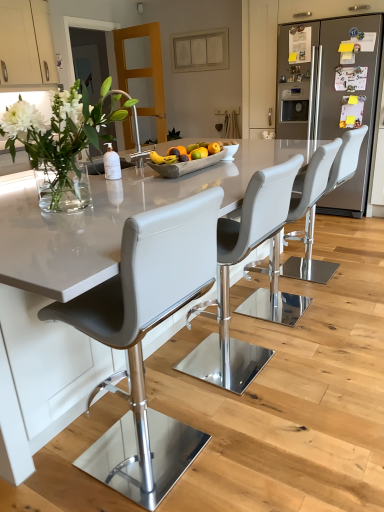
Question: From the image's perspective, is white glossy table at center located beneath clear glass vase at left?

Choices:
 (A) yes
 (B) no

Answer: (A)

Question: Is white glossy table at center not within clear glass vase at left?

Choices:
 (A) yes
 (B) no

Answer: (A)

Question: Is white glossy table at center not close to clear glass vase at left?

Choices:
 (A) yes
 (B) no

Answer: (B)

Question: Is white glossy table at center positioned with its back to clear glass vase at left?

Choices:
 (A) yes
 (B) no

Answer: (B)

Question: Does white glossy table at center turn towards clear glass vase at left?

Choices:
 (A) no
 (B) yes

Answer: (A)

Question: Is point 327,68 closer or farther from the camera than point 155,156?

Choices:
 (A) closer
 (B) farther

Answer: (B)

Question: Would you say satin silver refrigerator at right is inside or outside yellow matte bananas at center?

Choices:
 (A) outside
 (B) inside

Answer: (A)

Question: In terms of size, does satin silver refrigerator at right appear bigger or smaller than yellow matte bananas at center?

Choices:
 (A) small
 (B) big

Answer: (B)

Question: From a real-world perspective, is satin silver refrigerator at right positioned above or below yellow matte bananas at center?

Choices:
 (A) above
 (B) below

Answer: (B)

Question: In terms of height, does white leather bar stool at center, acting as the fourth chair starting from the front, look taller or shorter compared to matte gray chair at center, which ranks as the fourth chair in back-to-front order?

Choices:
 (A) tall
 (B) short

Answer: (B)

Question: From a real-world perspective, relative to matte gray chair at center, which ranks as the fourth chair in back-to-front order, is white leather bar stool at center, acting as the fourth chair starting from the front, vertically above or below?

Choices:
 (A) above
 (B) below

Answer: (B)

Question: Do you think white leather bar stool at center, acting as the fourth chair starting from the front, is within matte gray chair at center, acting as the 1th chair starting from the front, or outside of it?

Choices:
 (A) outside
 (B) inside

Answer: (A)

Question: Based on their sizes in the image, would you say white leather bar stool at center, acting as the fourth chair starting from the front, is bigger or smaller than matte gray chair at center, which ranks as the fourth chair in back-to-front order?

Choices:
 (A) big
 (B) small

Answer: (B)

Question: Is white glossy table at center taller or shorter than white leather bar stool at center, placed as the first chair when sorted from back to front?

Choices:
 (A) short
 (B) tall

Answer: (A)

Question: Considering the relative positions of white glossy table at center and white leather bar stool at center, acting as the fourth chair starting from the front, in the image provided, is white glossy table at center to the left or to the right of white leather bar stool at center, acting as the fourth chair starting from the front,?

Choices:
 (A) right
 (B) left

Answer: (B)